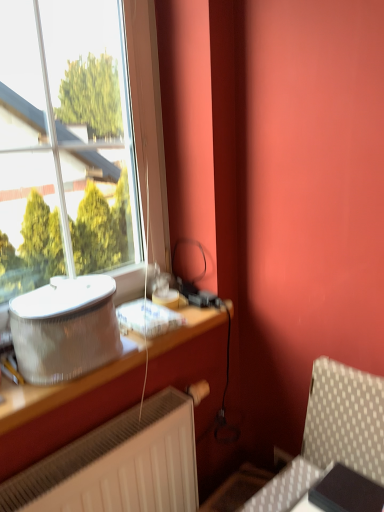
Image resolution: width=384 pixels, height=512 pixels. Find the location of `silver metallic speaker at left`. silver metallic speaker at left is located at coordinates (65, 328).

In order to face silver metallic speaker at left, should I rotate leftwards or rightwards?

To align with it, rotate left about 16.238°.

What do you see at coordinates (65, 328) in the screenshot?
I see `silver metallic speaker at left` at bounding box center [65, 328].

What is the approximate width of silver metallic speaker at left?

It is 17.61 centimeters.

The image size is (384, 512). What do you see at coordinates (62, 389) in the screenshot?
I see `metallic silver table at left` at bounding box center [62, 389].

Find the location of a particular element. The height and width of the screenshot is (512, 384). metallic silver table at left is located at coordinates (62, 389).

Locate an element on the screen. The height and width of the screenshot is (512, 384). silver metallic speaker at left is located at coordinates (65, 328).

Based on their positions, is silver metallic speaker at left located to the left or right of metallic silver table at left?

silver metallic speaker at left is to the left of metallic silver table at left.

Between silver metallic speaker at left and metallic silver table at left, which one is positioned in front?

metallic silver table at left is more forward.

Which is behind, point (31, 342) or point (36, 410)?

The point (31, 342) is behind.

From the image's perspective, is silver metallic speaker at left positioned above or below metallic silver table at left?

From the image's perspective, silver metallic speaker at left appears above metallic silver table at left.

From a real-world perspective, is silver metallic speaker at left physically located above or below metallic silver table at left?

silver metallic speaker at left is above metallic silver table at left.

Considering the sizes of silver metallic speaker at left and metallic silver table at left in the image, is silver metallic speaker at left wider or thinner than metallic silver table at left?

Clearly, silver metallic speaker at left has less width compared to metallic silver table at left.

Is silver metallic speaker at left taller than metallic silver table at left?

Indeed, silver metallic speaker at left has a greater height compared to metallic silver table at left.

Is silver metallic speaker at left bigger or smaller than metallic silver table at left?

Considering their sizes, silver metallic speaker at left takes up less space than metallic silver table at left.

Does silver metallic speaker at left contain metallic silver table at left?

No, silver metallic speaker at left does not contain metallic silver table at left.

Is silver metallic speaker at left next to metallic silver table at left and touching it?

No, silver metallic speaker at left is not touching metallic silver table at left.

Is silver metallic speaker at left facing towards metallic silver table at left?

No, silver metallic speaker at left is not aimed at metallic silver table at left.

What's the angular difference between silver metallic speaker at left and metallic silver table at left's facing directions?

The angle between the facing direction of silver metallic speaker at left and the facing direction of metallic silver table at left is 0.673 degrees.

How much distance is there between silver metallic speaker at left and metallic silver table at left?

The distance of silver metallic speaker at left from metallic silver table at left is 5.14 inches.

Find the location of a particular element. The width and height of the screenshot is (384, 512). appliance above the metallic silver table at left (from the image's perspective) is located at coordinates (65, 328).

Can you confirm if metallic silver table at left is positioned to the right of silver metallic speaker at left?

Correct, you'll find metallic silver table at left to the right of silver metallic speaker at left.

Which object is more forward, metallic silver table at left or silver metallic speaker at left?

metallic silver table at left.

Is point (24, 399) behind point (97, 285)?

No.

From the image's perspective, would you say metallic silver table at left is shown under silver metallic speaker at left?

Correct, metallic silver table at left appears lower than silver metallic speaker at left in the image.

From a real-world perspective, is metallic silver table at left positioned over silver metallic speaker at left based on gravity?

No, from a real-world perspective, metallic silver table at left is not above silver metallic speaker at left.

Is metallic silver table at left wider than silver metallic speaker at left?

Yes.

Considering the sizes of metallic silver table at left and silver metallic speaker at left in the image, is metallic silver table at left taller or shorter than silver metallic speaker at left?

In the image, metallic silver table at left appears to be shorter than silver metallic speaker at left.

Which of these two, metallic silver table at left or silver metallic speaker at left, is smaller?

Smaller between the two is silver metallic speaker at left.

Is metallic silver table at left situated inside silver metallic speaker at left or outside?

The correct answer is: outside.

Is metallic silver table at left directly adjacent to silver metallic speaker at left?

No, metallic silver table at left is not with silver metallic speaker at left.

Is metallic silver table at left turned away from silver metallic speaker at left?

No, metallic silver table at left is not facing the opposite direction of silver metallic speaker at left.

How many degrees apart are the facing directions of metallic silver table at left and silver metallic speaker at left?

metallic silver table at left and silver metallic speaker at left are facing 0.673 degrees away from each other.

Locate an element on the screen. This screenshot has height=512, width=384. table located on the right of silver metallic speaker at left is located at coordinates (62, 389).

Where is `appliance on the left of metallic silver table at left`? appliance on the left of metallic silver table at left is located at coordinates (65, 328).

This screenshot has height=512, width=384. Identify the location of table below the silver metallic speaker at left (from the image's perspective). (62, 389).